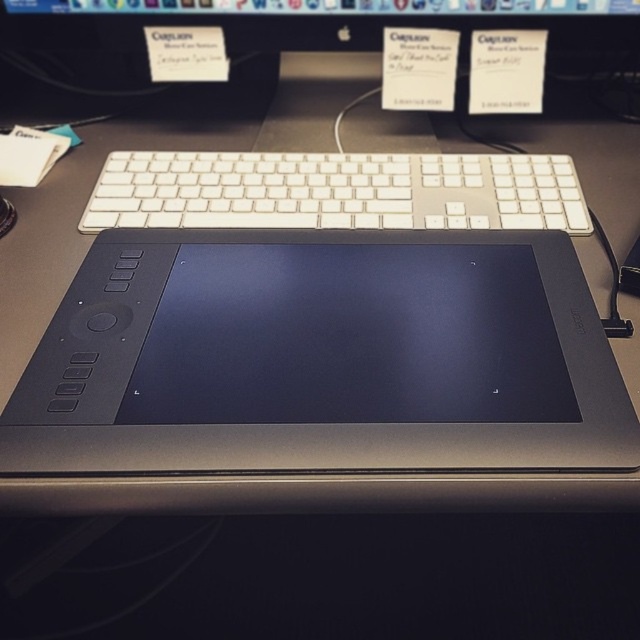
Consider the image. You are setting up your workspace and need to place a new mouse between the white plastic keyboard at upper center and the black plastic computer monitor at upper center. According to their positions, where should you place the mouse?

The white plastic keyboard at upper center is positioned on the right side of the black plastic computer monitor at upper center. Therefore, you should place the mouse to the left of the white plastic keyboard at upper center or to the right of the black plastic computer monitor at upper center to ensure it is between them.

You are setting up a new desk arrangement and want to place a decorative item between the black matte tablet at center and the white plastic keyboard at upper center. Given their sizes, where should you position the decorative item to ensure it doesn

The black matte tablet at center is taller than the white plastic keyboard at upper center. Therefore, placing the decorative item between them vertically would be appropriate, as the tablet occupies a higher position than the keyboard.

You are setting up your desk and want to place a new mouse between the black matte tablet at center and the white plastic keyboard at upper center. Based on their positions, where should you place the mouse so it is equidistant from both objects?

Since the black matte tablet at center is closer to the viewer than the white plastic keyboard at upper center, placing the mouse halfway between them along the line of sight would ensure it is equidistant from both objects.